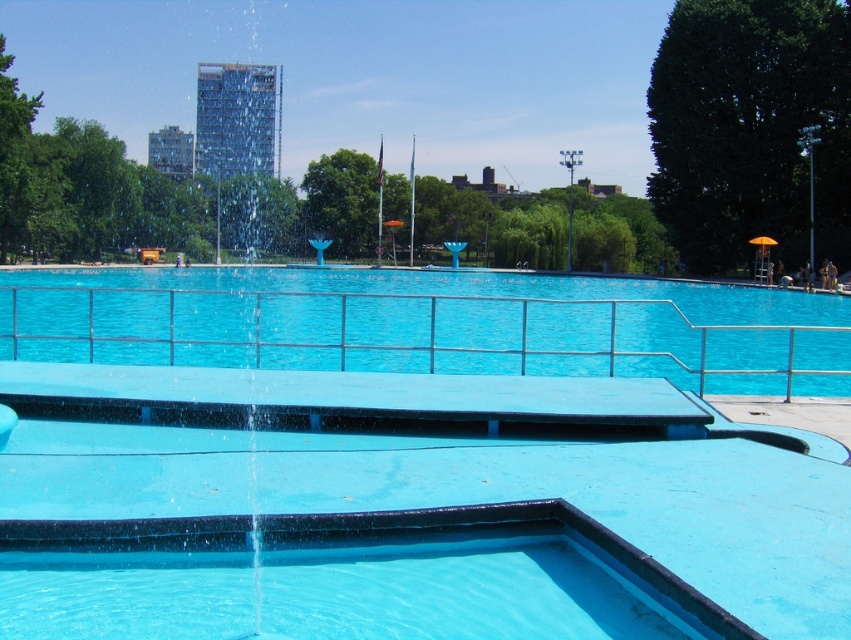
Question: Which object appears farthest from the camera in this image?

Choices:
 (A) smooth blue pool at center
 (B) blue rubber pool at center

Answer: (B)

Question: Where is smooth blue pool at center located in relation to blue rubber pool at center in the image?

Choices:
 (A) below
 (B) above

Answer: (A)

Question: Where is smooth blue pool at center located in relation to blue rubber pool at center in the image?

Choices:
 (A) above
 (B) below

Answer: (B)

Question: Does smooth blue pool at center appear under blue rubber pool at center?

Choices:
 (A) no
 (B) yes

Answer: (B)

Question: Among these points, which one is farthest from the camera?

Choices:
 (A) (20, 364)
 (B) (570, 316)

Answer: (B)